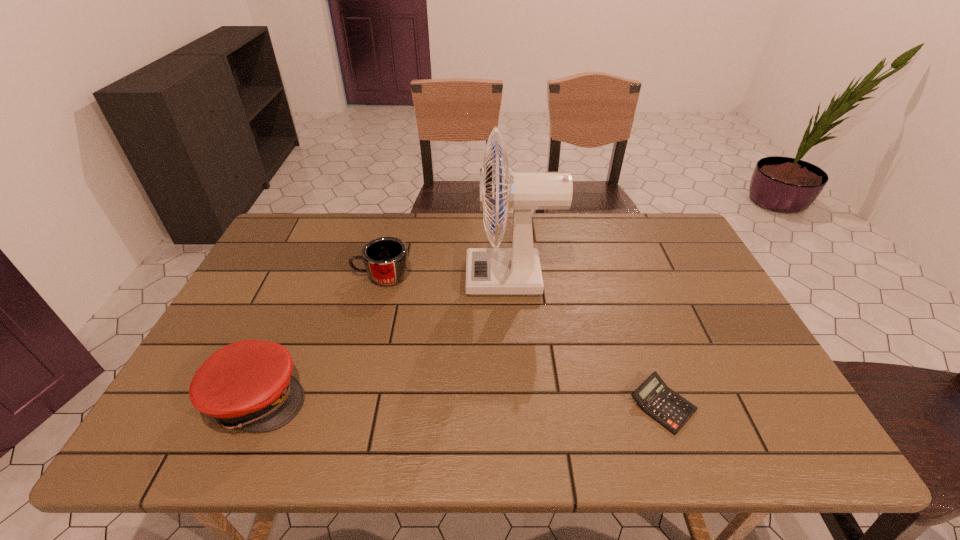
Where is `vacant space at the near edge of the desktop`? vacant space at the near edge of the desktop is located at coordinates (617, 443).

At what (x,y) coordinates should I click in order to perform the action: click on free spot at the left edge of the desktop. Please return your answer as a coordinate pair (x, y). The height and width of the screenshot is (540, 960). Looking at the image, I should click on (232, 315).

I want to click on vacant area at the right edge of the desktop, so click(756, 379).

At what (x,y) coordinates should I click in order to perform the action: click on vacant space at the far left corner. Please return your answer as a coordinate pair (x, y). The image size is (960, 540). Looking at the image, I should click on (295, 238).

Identify the location of vacant space at the far right corner of the desktop. This screenshot has height=540, width=960. (641, 242).

This screenshot has width=960, height=540. In the image, there is a desktop. Identify the location of free space at the near right corner. (760, 422).

The image size is (960, 540). What are the coordinates of `vacant space that is in between the cap and the second object from right to left` in the screenshot? It's located at (385, 338).

I want to click on free point between the calculator and the tallest object, so click(587, 341).

Where is `vacant space that is in between the cap and the rightmost object`? This screenshot has width=960, height=540. vacant space that is in between the cap and the rightmost object is located at coordinates (460, 401).

At what (x,y) coordinates should I click in order to perform the action: click on vacant space in between the fan and the shortest object. Please return your answer as a coordinate pair (x, y). This screenshot has width=960, height=540. Looking at the image, I should click on (587, 341).